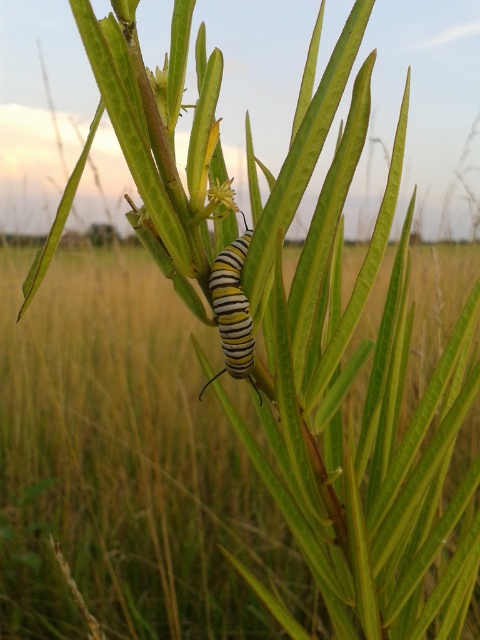
You are a biologist observing the monarch caterpillar in the image. You notice a point marked at coordinates point (232, 310). Based on the scene, can you determine what this point is located on?

The point (232, 310) is located on the yellow striped caterpillar at center.

You are a photographer trying to capture a detailed shot of the monarch caterpillar. You notice two points in the scene at coordinates point (158, 81) and point (225, 189). Which point is closer to your camera lens?

Point (225, 189) is closer to the camera lens because point (158, 81) is further away from the camera than point (225, 189).